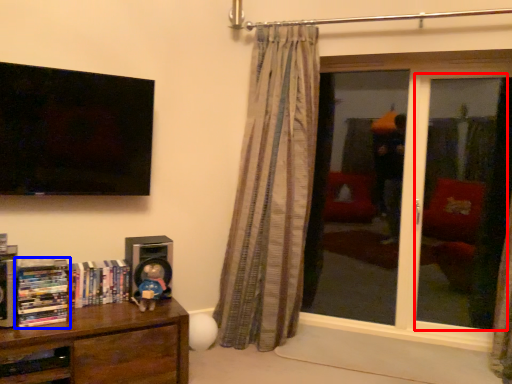
Question: Which object is closer to the camera taking this photo, screen door (highlighted by a red box) or book (highlighted by a blue box)?

Choices:
 (A) screen door
 (B) book

Answer: (B)